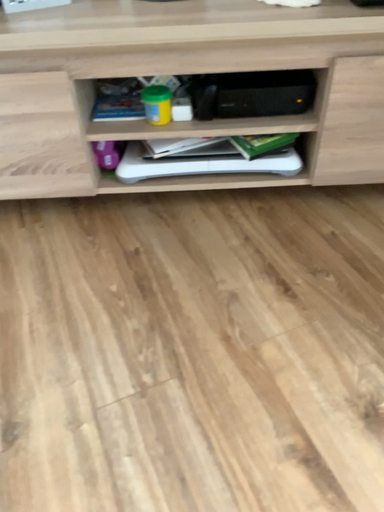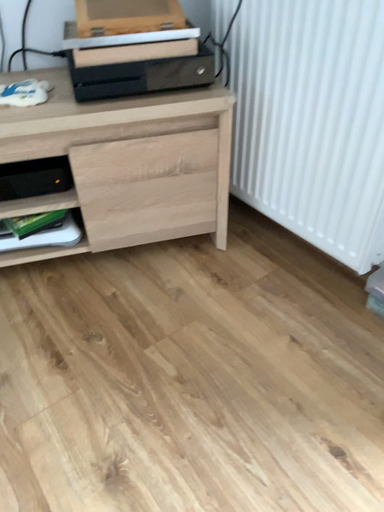
Question: How did the camera likely rotate when shooting the video?

Choices:
 (A) rotated right
 (B) rotated left

Answer: (A)